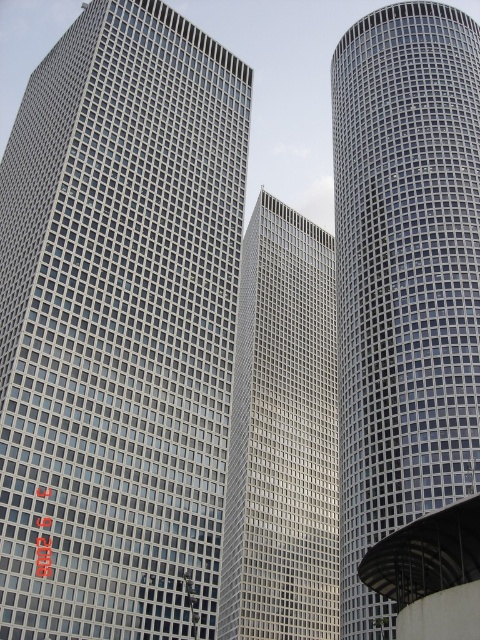
Question: Is matte glass building at left wider than matte glass skyscraper at center?

Choices:
 (A) yes
 (B) no

Answer: (A)

Question: Can you confirm if matte glass building at left is bigger than metallic grid tower at center?

Choices:
 (A) yes
 (B) no

Answer: (B)

Question: Which object appears farthest from the camera in this image?

Choices:
 (A) metallic grid tower at center
 (B) matte glass building at left

Answer: (B)

Question: Considering the real-world distances, which object is farthest from the matte glass building at left?

Choices:
 (A) matte glass skyscraper at center
 (B) metallic grid tower at center

Answer: (A)

Question: Which point is closer to the camera?

Choices:
 (A) metallic grid tower at center
 (B) matte glass building at left
 (C) matte glass skyscraper at center

Answer: (A)

Question: Is metallic grid tower at center smaller than matte glass skyscraper at center?

Choices:
 (A) yes
 (B) no

Answer: (B)